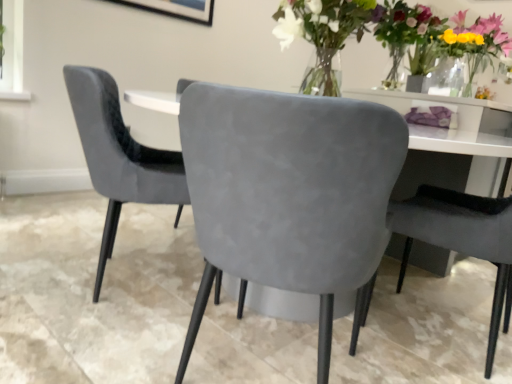
Image resolution: width=512 pixels, height=384 pixels. In order to click on free space to the back side of velvet grey chair at center, which is the third chair from right to left in this screenshot , I will do `click(141, 237)`.